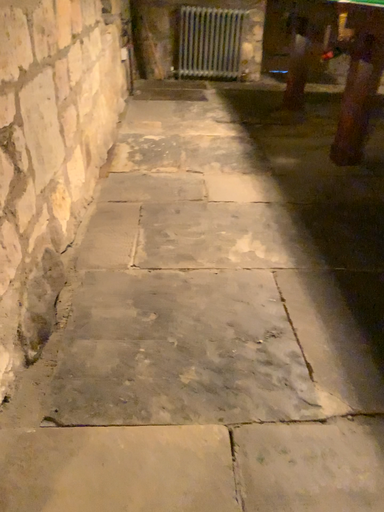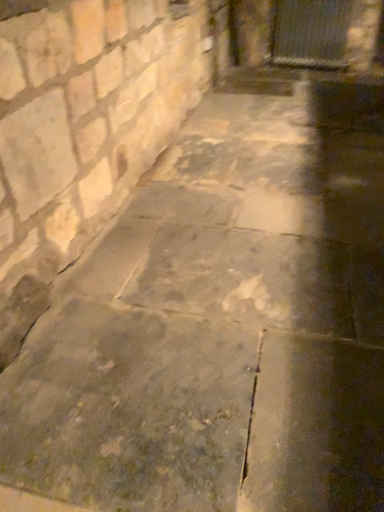
Question: Which way did the camera rotate in the video?

Choices:
 (A) rotated left
 (B) rotated right

Answer: (A)